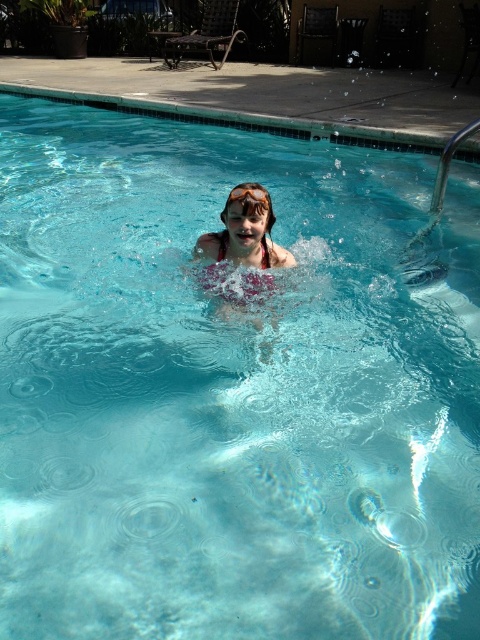
You are a lifeguard and need to place a floating buoy between the pink fabric swim cap at center and the orange rubber goggles at center. Which object should the buoy be closer to if the swim cap is wider?

The pink fabric swim cap at center is wider than the orange rubber goggles at center, so the floating buoy should be placed closer to the orange rubber goggles at center to ensure equal distance from both objects.

You are standing at point (256, 204) and want to move to point (235, 218). Is the destination point behind you or in front of you?

The destination point (235, 218) is behind you because it is located behind point (256, 204) where you are standing.